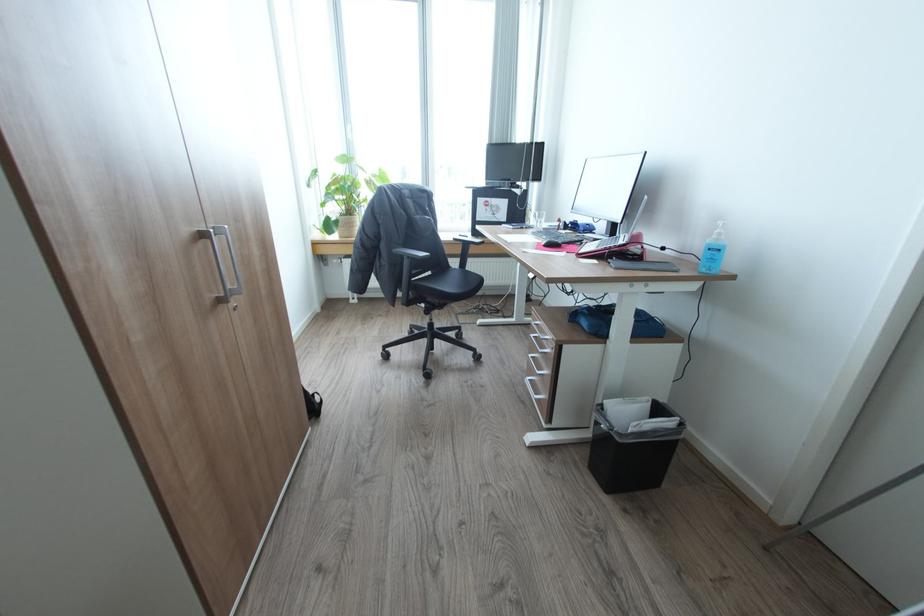
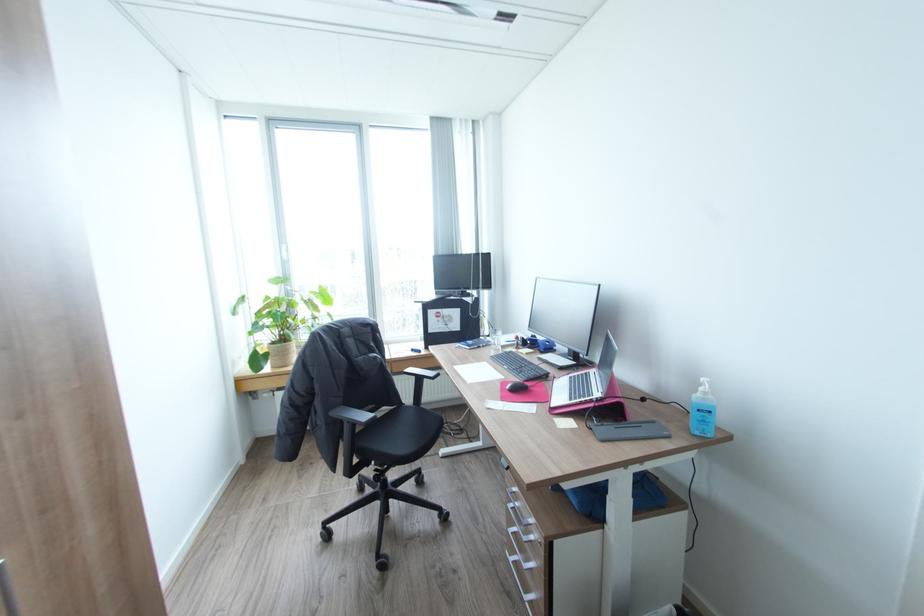
Find the pixel in the second image that matches point (538, 336) in the first image.

(517, 508)